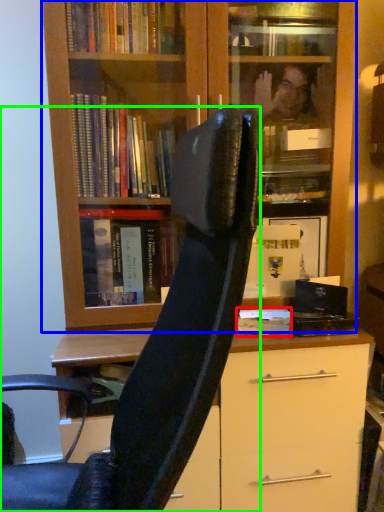
Question: Considering the real-world distances, which object is farthest from paperback book (highlighted by a red box)? bookcase (highlighted by a blue box) or chair (highlighted by a green box)?

Choices:
 (A) bookcase
 (B) chair

Answer: (A)